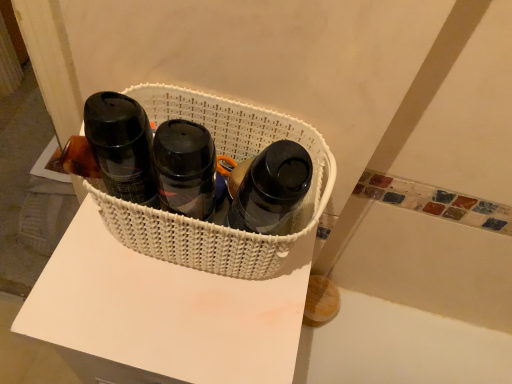
Question: Is matte black bottle at center, which ranks as the first bottle in right-to-left order, oriented away from white woven basket at center?

Choices:
 (A) no
 (B) yes

Answer: (B)

Question: Does matte black bottle at center, which ranks as the first bottle in right-to-left order, have a larger size compared to white woven basket at center?

Choices:
 (A) yes
 (B) no

Answer: (B)

Question: Is matte black bottle at center, which ranks as the first bottle in right-to-left order, taller than white woven basket at center?

Choices:
 (A) yes
 (B) no

Answer: (A)

Question: From the image's perspective, does matte black bottle at center, which ranks as the first bottle in right-to-left order, appear higher than white woven basket at center?

Choices:
 (A) no
 (B) yes

Answer: (A)

Question: Is matte black bottle at center, placed as the second bottle when sorted from left to right, smaller than white woven basket at center?

Choices:
 (A) no
 (B) yes

Answer: (B)

Question: Can you confirm if matte black bottle at center, which ranks as the first bottle in right-to-left order, is shorter than white woven basket at center?

Choices:
 (A) yes
 (B) no

Answer: (B)

Question: Is white woven basket at center positioned in front of white woven basket at center?

Choices:
 (A) no
 (B) yes

Answer: (A)

Question: Is white woven basket at center further to the viewer compared to white woven basket at center?

Choices:
 (A) no
 (B) yes

Answer: (B)

Question: Can you confirm if white woven basket at center is positioned to the left of white woven basket at center?

Choices:
 (A) yes
 (B) no

Answer: (A)

Question: Is white woven basket at center inside white woven basket at center?

Choices:
 (A) no
 (B) yes

Answer: (A)

Question: Can you confirm if white woven basket at center is smaller than white woven basket at center?

Choices:
 (A) yes
 (B) no

Answer: (B)

Question: Considering the relative sizes of white woven basket at center and white woven basket at center in the image provided, is white woven basket at center bigger than white woven basket at center?

Choices:
 (A) no
 (B) yes

Answer: (B)

Question: From the image's perspective, would you say matte black thermos at left, the 2th bottle from the right, is positioned over white woven basket at center?

Choices:
 (A) yes
 (B) no

Answer: (A)